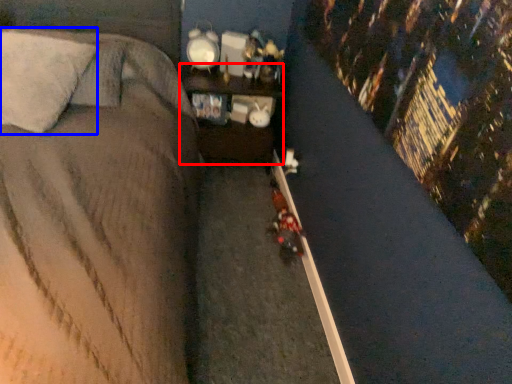
Question: Which object appears farthest to the camera in this image, furniture (highlighted by a red box) or pillow (highlighted by a blue box)?

Choices:
 (A) furniture
 (B) pillow

Answer: (A)